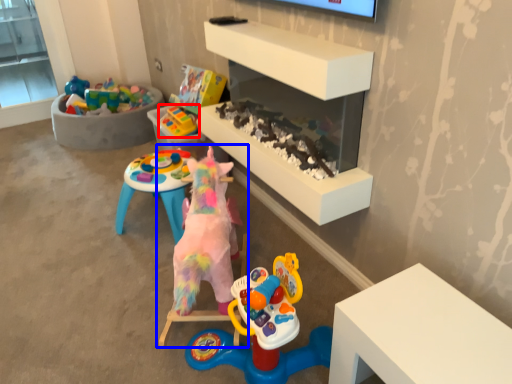
Question: Among these objects, which one is farthest to the camera, toy (highlighted by a red box) or toy (highlighted by a blue box)?

Choices:
 (A) toy
 (B) toy

Answer: (A)